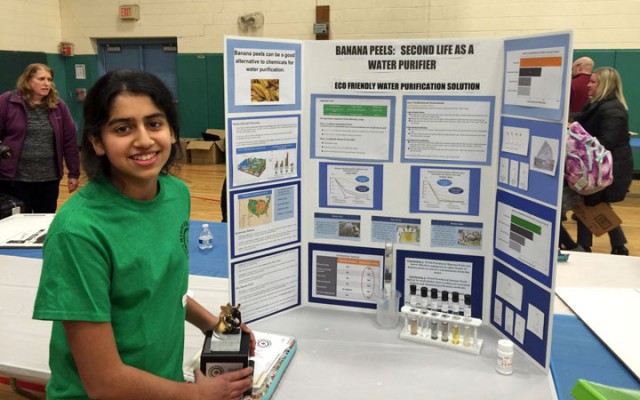
Where is `white plastic horizontal table`? white plastic horizontal table is located at coordinates (587, 277), (340, 368).